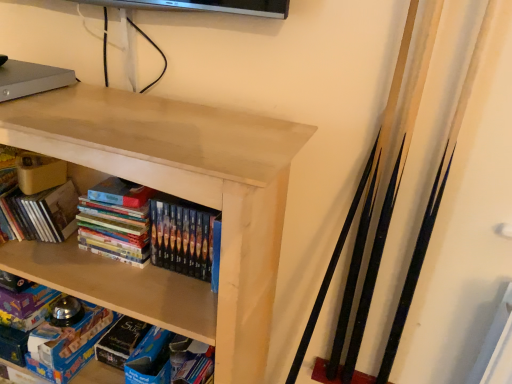
The height and width of the screenshot is (384, 512). I want to click on blue matte board game at lower left, so click(67, 344).

What do you see at coordinates (36, 197) in the screenshot? I see `matte cardboard book at upper left, which appears as the 2th book when viewed from the right` at bounding box center [36, 197].

Describe the element at coordinates (186, 192) in the screenshot. I see `matte wood shelf at upper center` at that location.

What do you see at coordinates (115, 222) in the screenshot?
I see `multicolored glossy books at center, positioned as the 2th book in left-to-right order` at bounding box center [115, 222].

Where is `blue matte board game at lower left`? The image size is (512, 384). blue matte board game at lower left is located at coordinates (67, 344).

Considering the relative sizes of blue matte board game at lower left and multicolored glossy books at center, placed as the 1th book when sorted from right to left, in the image provided, is blue matte board game at lower left smaller than multicolored glossy books at center, placed as the 1th book when sorted from right to left,?

Indeed, blue matte board game at lower left has a smaller size compared to multicolored glossy books at center, placed as the 1th book when sorted from right to left.

From the image's perspective, is blue matte board game at lower left beneath multicolored glossy books at center, positioned as the 2th book in left-to-right order?

Correct, blue matte board game at lower left appears lower than multicolored glossy books at center, positioned as the 2th book in left-to-right order, in the image.

Does blue matte board game at lower left turn towards multicolored glossy books at center, placed as the 1th book when sorted from right to left?

No, blue matte board game at lower left is not facing towards multicolored glossy books at center, placed as the 1th book when sorted from right to left.

From a real-world perspective, which is physically below, blue matte board game at lower left or multicolored glossy books at center, placed as the 1th book when sorted from right to left?

blue matte board game at lower left.

Between point (55, 196) and point (45, 372), which one is positioned in front?

Positioned in front is point (55, 196).

From the image's perspective, does matte cardboard book at upper left, which appears as the 2th book when viewed from the right, appear higher than blue matte board game at lower left?

Yes, from the image's perspective, matte cardboard book at upper left, which appears as the 2th book when viewed from the right, is over blue matte board game at lower left.

Are matte cardboard book at upper left, which is the first book in left-to-right order, and blue matte board game at lower left beside each other?

matte cardboard book at upper left, which is the first book in left-to-right order, and blue matte board game at lower left are clearly separated.

Is matte wood shelf at upper center far away from matte cardboard book at upper left, which appears as the 2th book when viewed from the right?

They are positioned close to each other.

From the image's perspective, relative to matte cardboard book at upper left, which is the first book in left-to-right order, is matte wood shelf at upper center above or below?

Clearly, from the image's perspective, matte wood shelf at upper center is below matte cardboard book at upper left, which is the first book in left-to-right order.

Is matte wood shelf at upper center completely or partially outside of matte cardboard book at upper left, which is the first book in left-to-right order?

Yes, matte wood shelf at upper center is located beyond the bounds of matte cardboard book at upper left, which is the first book in left-to-right order.

Can you confirm if matte wood shelf at upper center is positioned to the right of matte cardboard book at upper left, which is the first book in left-to-right order?

Indeed, matte wood shelf at upper center is positioned on the right side of matte cardboard book at upper left, which is the first book in left-to-right order.

From a real-world perspective, does blue matte board game at lower left sit lower than matte wood shelf at upper center?

Indeed, from a real-world perspective, blue matte board game at lower left is positioned beneath matte wood shelf at upper center.

Which is correct: blue matte board game at lower left is inside matte wood shelf at upper center, or outside of it?

blue matte board game at lower left fits inside matte wood shelf at upper center.

From the image's perspective, is blue matte board game at lower left located beneath matte wood shelf at upper center?

Indeed, from the image's perspective, blue matte board game at lower left is shown beneath matte wood shelf at upper center.

Is blue matte board game at lower left directly adjacent to matte wood shelf at upper center?

There is a gap between blue matte board game at lower left and matte wood shelf at upper center.

How far apart are matte cardboard book at upper left, which appears as the 2th book when viewed from the right, and multicolored glossy books at center, positioned as the 2th book in left-to-right order?

6.25 inches.

In the image, is matte cardboard book at upper left, which is the first book in left-to-right order, on the left side or the right side of multicolored glossy books at center, positioned as the 2th book in left-to-right order?

In the image, matte cardboard book at upper left, which is the first book in left-to-right order, appears on the left side of multicolored glossy books at center, positioned as the 2th book in left-to-right order.

From a real-world perspective, is matte cardboard book at upper left, which is the first book in left-to-right order, beneath multicolored glossy books at center, placed as the 1th book when sorted from right to left?

Yes, from a real-world perspective, matte cardboard book at upper left, which is the first book in left-to-right order, is beneath multicolored glossy books at center, placed as the 1th book when sorted from right to left.

Can you tell me how much multicolored glossy books at center, positioned as the 2th book in left-to-right order, and matte wood shelf at upper center differ in facing direction?

multicolored glossy books at center, positioned as the 2th book in left-to-right order, and matte wood shelf at upper center are facing 0.24 degrees away from each other.

Which of these two, multicolored glossy books at center, positioned as the 2th book in left-to-right order, or matte wood shelf at upper center, stands shorter?

Standing shorter between the two is multicolored glossy books at center, positioned as the 2th book in left-to-right order.

In the image, there is a multicolored glossy books at center, placed as the 1th book when sorted from right to left. Where is `shelf below it (from the image's perspective)`? shelf below it (from the image's perspective) is located at coordinates (186, 192).

Choose the correct answer: Is multicolored glossy books at center, placed as the 1th book when sorted from right to left, inside matte wood shelf at upper center or outside it?

multicolored glossy books at center, placed as the 1th book when sorted from right to left, is inside matte wood shelf at upper center.

Find the location of a particular element. This screenshot has width=512, height=384. paperback book on the right of matte cardboard book at upper left, which is the first book in left-to-right order is located at coordinates (67, 344).

Measure the distance between blue matte board game at lower left and matte cardboard book at upper left, which appears as the 2th book when viewed from the right.

blue matte board game at lower left and matte cardboard book at upper left, which appears as the 2th book when viewed from the right, are 11.73 inches apart.

Which is nearer, (46, 366) or (52, 158)?

Point (46, 366) appears to be farther away from the viewer than point (52, 158).

Which is correct: blue matte board game at lower left is inside matte cardboard book at upper left, which is the first book in left-to-right order, or outside of it?

blue matte board game at lower left exists outside the volume of matte cardboard book at upper left, which is the first book in left-to-right order.

This screenshot has width=512, height=384. I want to click on paperback book behind the multicolored glossy books at center, positioned as the 2th book in left-to-right order, so click(x=67, y=344).

Where is `the 2nd book above when counting from the blue matte board game at lower left (from the image's perspective)`? the 2nd book above when counting from the blue matte board game at lower left (from the image's perspective) is located at coordinates (36, 197).

Based on the photo, based on their spatial positions, is matte wood shelf at upper center or blue matte board game at lower left closer to matte cardboard book at upper left, which is the first book in left-to-right order?

blue matte board game at lower left lies closer to matte cardboard book at upper left, which is the first book in left-to-right order, than the other object.

Based on the photo, when comparing their distances from matte wood shelf at upper center, does matte cardboard book at upper left, which appears as the 2th book when viewed from the right, or blue matte board game at lower left seem closer?

Among the two, matte cardboard book at upper left, which appears as the 2th book when viewed from the right, is located nearer to matte wood shelf at upper center.

From the image, which object appears to be nearer to blue matte board game at lower left, matte cardboard book at upper left, which is the first book in left-to-right order, or matte wood shelf at upper center?

The object closer to blue matte board game at lower left is matte cardboard book at upper left, which is the first book in left-to-right order.

Consider the image. Considering their positions, is matte wood shelf at upper center positioned closer to matte cardboard book at upper left, which is the first book in left-to-right order, than multicolored glossy books at center, positioned as the 2th book in left-to-right order?

multicolored glossy books at center, positioned as the 2th book in left-to-right order.

Based on their spatial positions, is matte cardboard book at upper left, which is the first book in left-to-right order, or multicolored glossy books at center, positioned as the 2th book in left-to-right order, closer to blue matte board game at lower left?

Based on the image, multicolored glossy books at center, positioned as the 2th book in left-to-right order, appears to be nearer to blue matte board game at lower left.

Looking at the image, which one is located further to multicolored glossy books at center, positioned as the 2th book in left-to-right order, blue matte board game at lower left or matte cardboard book at upper left, which is the first book in left-to-right order?

The object further to multicolored glossy books at center, positioned as the 2th book in left-to-right order, is blue matte board game at lower left.

Based on their spatial positions, is matte cardboard book at upper left, which appears as the 2th book when viewed from the right, or matte wood shelf at upper center closer to multicolored glossy books at center, positioned as the 2th book in left-to-right order?

Based on the image, matte cardboard book at upper left, which appears as the 2th book when viewed from the right, appears to be nearer to multicolored glossy books at center, positioned as the 2th book in left-to-right order.

From the image, which object appears to be farther from matte cardboard book at upper left, which is the first book in left-to-right order, multicolored glossy books at center, placed as the 1th book when sorted from right to left, or blue matte board game at lower left?

blue matte board game at lower left.

The image size is (512, 384). In order to click on book positioned between matte wood shelf at upper center and matte cardboard book at upper left, which is the first book in left-to-right order, from near to far in this screenshot , I will do `click(115, 222)`.

This screenshot has width=512, height=384. I want to click on book between matte cardboard book at upper left, which appears as the 2th book when viewed from the right, and blue matte board game at lower left vertically, so click(x=115, y=222).